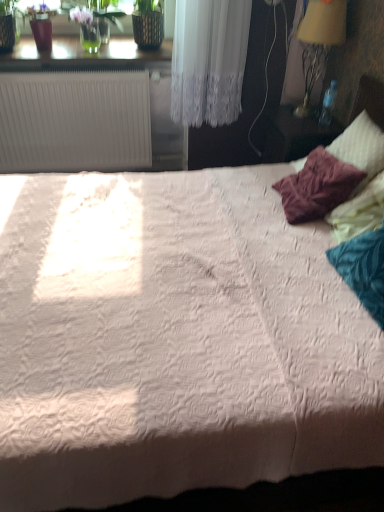
Question: Can you confirm if matte wooden nightstand at right is thinner than white plastic radiator at upper left?

Choices:
 (A) no
 (B) yes

Answer: (B)

Question: Does matte wooden nightstand at right come in front of white plastic radiator at upper left?

Choices:
 (A) yes
 (B) no

Answer: (A)

Question: From the image's perspective, would you say matte wooden nightstand at right is shown under white plastic radiator at upper left?

Choices:
 (A) no
 (B) yes

Answer: (B)

Question: From the image's perspective, is matte wooden nightstand at right above white plastic radiator at upper left?

Choices:
 (A) yes
 (B) no

Answer: (B)

Question: From a real-world perspective, is matte wooden nightstand at right located beneath white plastic radiator at upper left?

Choices:
 (A) no
 (B) yes

Answer: (A)

Question: Considering their positions, is white plastic radiator at upper left located in front of or behind matte wooden nightstand at right?

Choices:
 (A) front
 (B) behind

Answer: (B)

Question: Is white plastic radiator at upper left spatially inside matte wooden nightstand at right, or outside of it?

Choices:
 (A) inside
 (B) outside

Answer: (B)

Question: From the image's perspective, is white plastic radiator at upper left positioned above or below matte wooden nightstand at right?

Choices:
 (A) below
 (B) above

Answer: (B)

Question: Looking at their shapes, would you say white plastic radiator at upper left is wider or thinner than matte wooden nightstand at right?

Choices:
 (A) wide
 (B) thin

Answer: (A)

Question: From the image's perspective, is yellow fabric lampshade at upper right above or below matte wooden nightstand at right?

Choices:
 (A) below
 (B) above

Answer: (B)

Question: Based on their sizes in the image, would you say yellow fabric lampshade at upper right is bigger or smaller than matte wooden nightstand at right?

Choices:
 (A) small
 (B) big

Answer: (A)

Question: Considering the positions of yellow fabric lampshade at upper right and matte wooden nightstand at right in the image, is yellow fabric lampshade at upper right taller or shorter than matte wooden nightstand at right?

Choices:
 (A) short
 (B) tall

Answer: (B)

Question: In the image, is yellow fabric lampshade at upper right on the left side or the right side of matte wooden nightstand at right?

Choices:
 (A) right
 (B) left

Answer: (A)

Question: Considering the positions of matte wooden nightstand at right and yellow fabric lampshade at upper right in the image, is matte wooden nightstand at right wider or thinner than yellow fabric lampshade at upper right?

Choices:
 (A) thin
 (B) wide

Answer: (B)

Question: Is matte wooden nightstand at right to the left or to the right of yellow fabric lampshade at upper right in the image?

Choices:
 (A) right
 (B) left

Answer: (B)